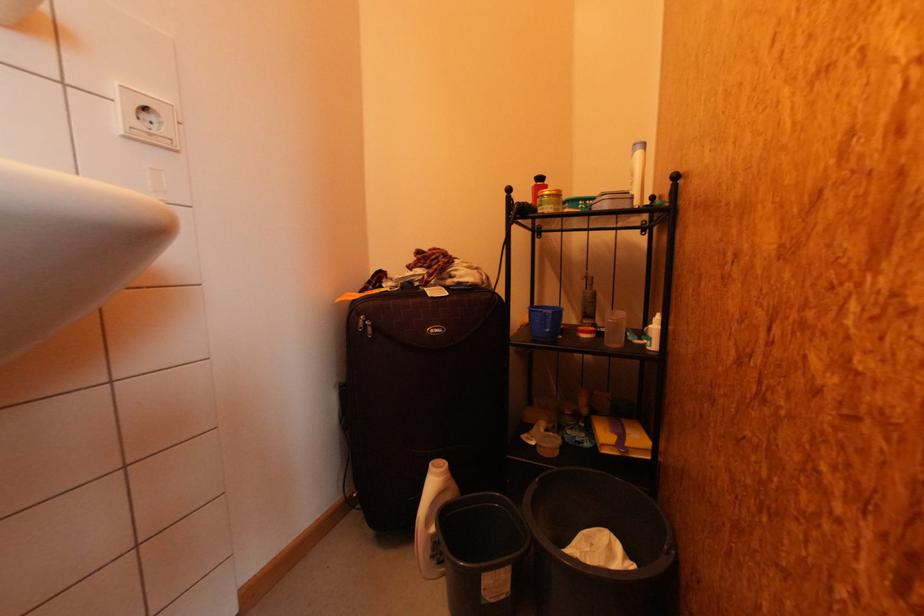
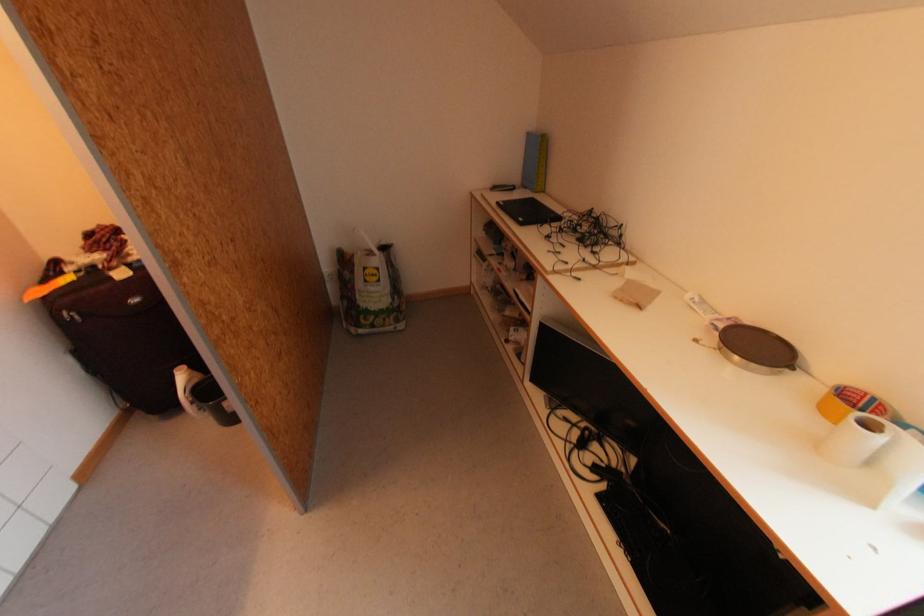
Where in the second image is the point corresponding to (416,284) from the first image?

(98, 267)